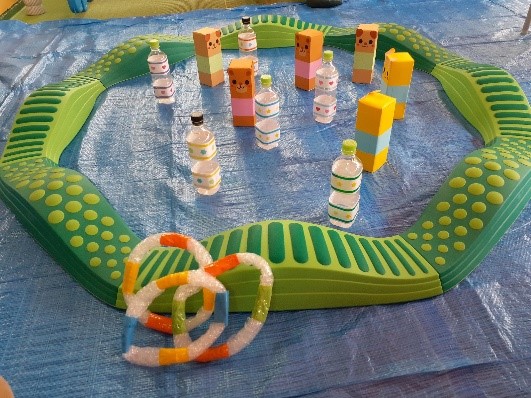
Where is `table`? The width and height of the screenshot is (531, 398). table is located at coordinates (504, 383).